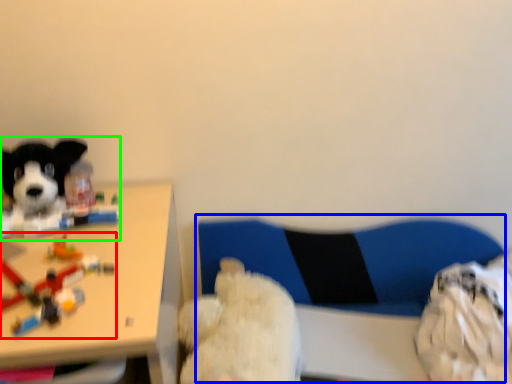
Question: Considering the real-world distances, which object is farthest from toy (highlighted by a red box)? swivel chair (highlighted by a blue box) or dog (highlighted by a green box)?

Choices:
 (A) swivel chair
 (B) dog

Answer: (A)